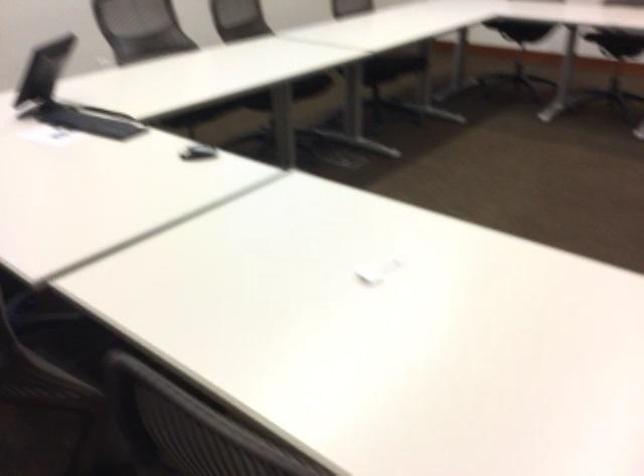
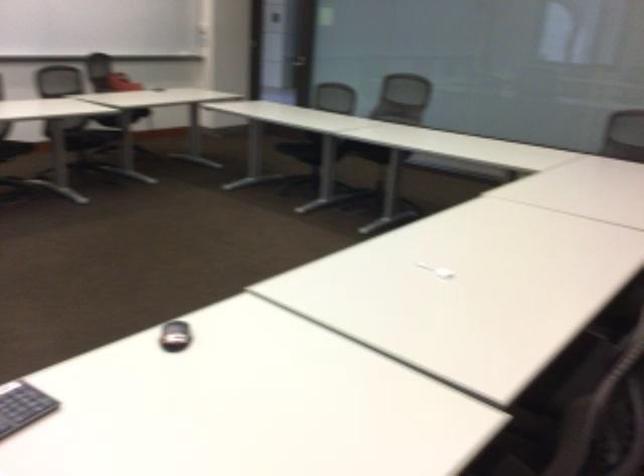
Question: In a continuous first-person perspective shot, in which direction is the camera moving?

Choices:
 (A) Left
 (B) Right
 (C) Forward
 (D) Backward

Answer: (D)